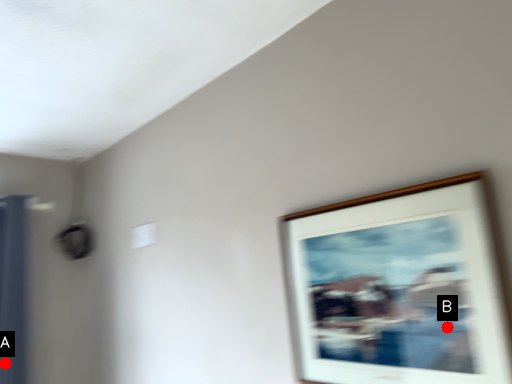
Question: Two points are circled on the image, labeled by A and B beside each circle. Which point appears closest to the camera in this image?

Choices:
 (A) A is closer
 (B) B is closer

Answer: (B)